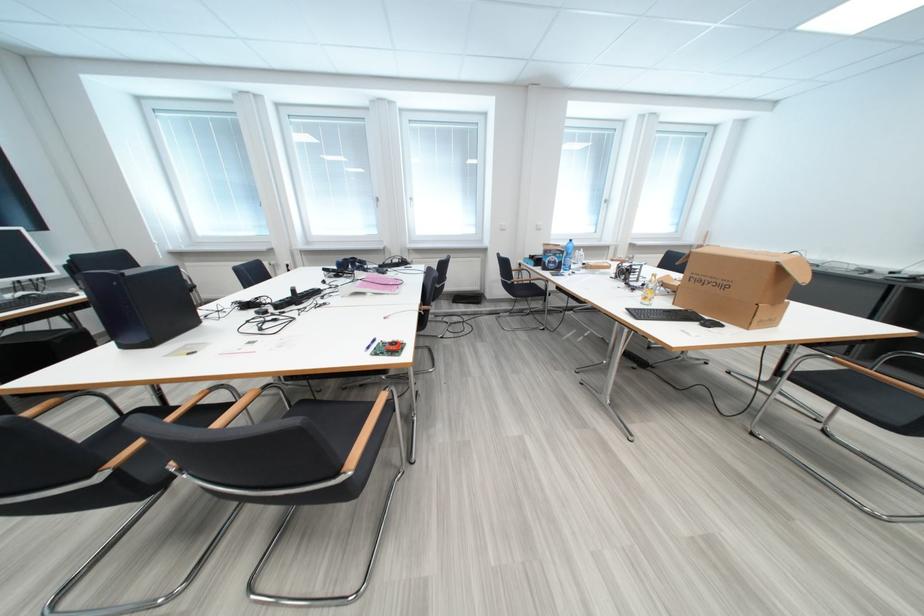
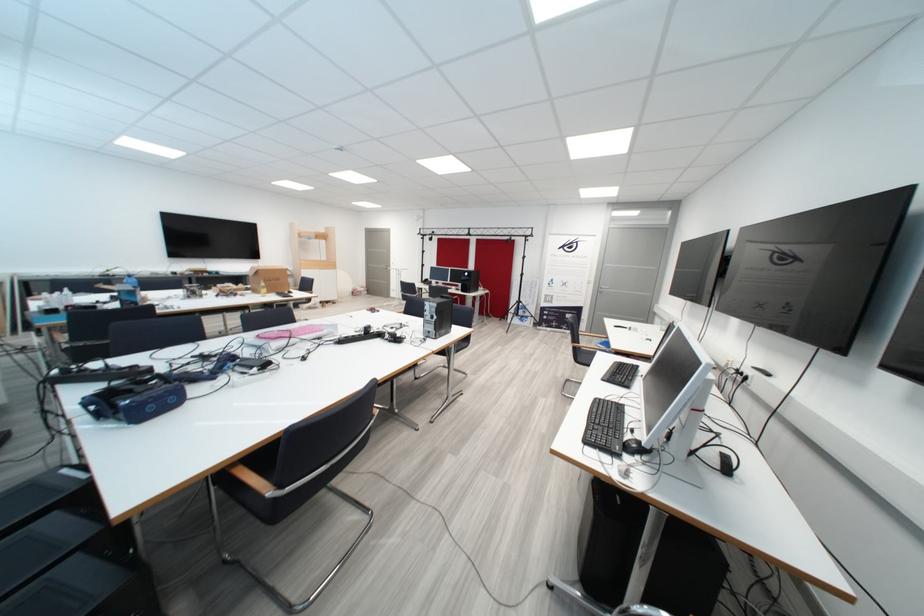
Question: I am providing you with two images of the same scene from different viewpoints. Please identify which objects are invisible in image2.

Choices:
 (A) black computer tower
 (B) blue VR headset
 (C) orange bar of soap
 (D) plastic water bottle

Answer: (A)